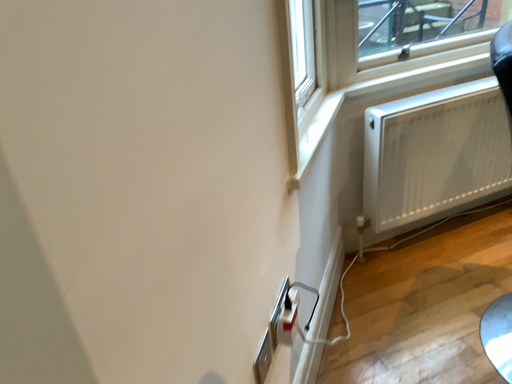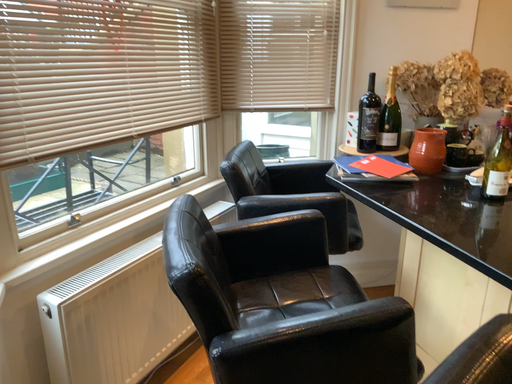
Question: Which way did the camera rotate in the video?

Choices:
 (A) rotated right
 (B) rotated left

Answer: (A)